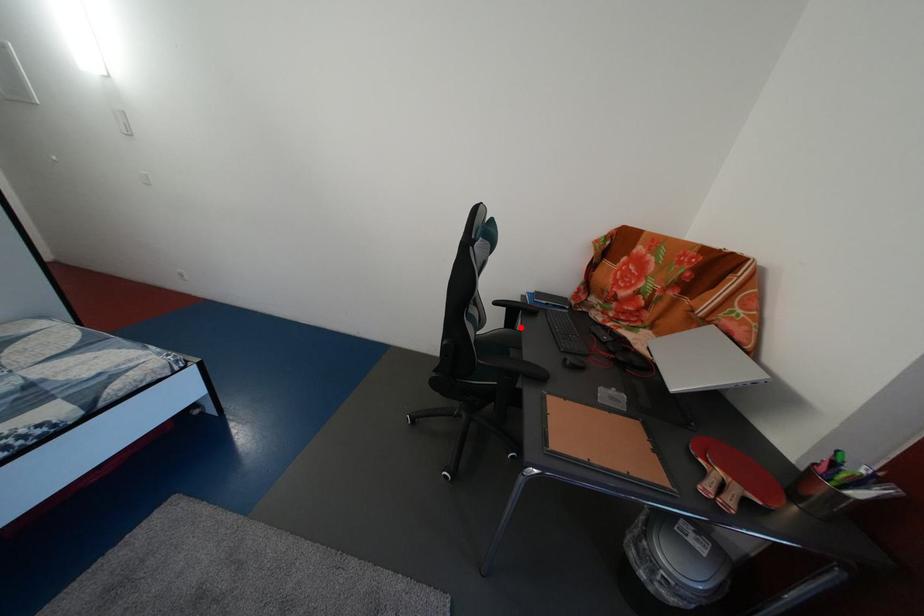
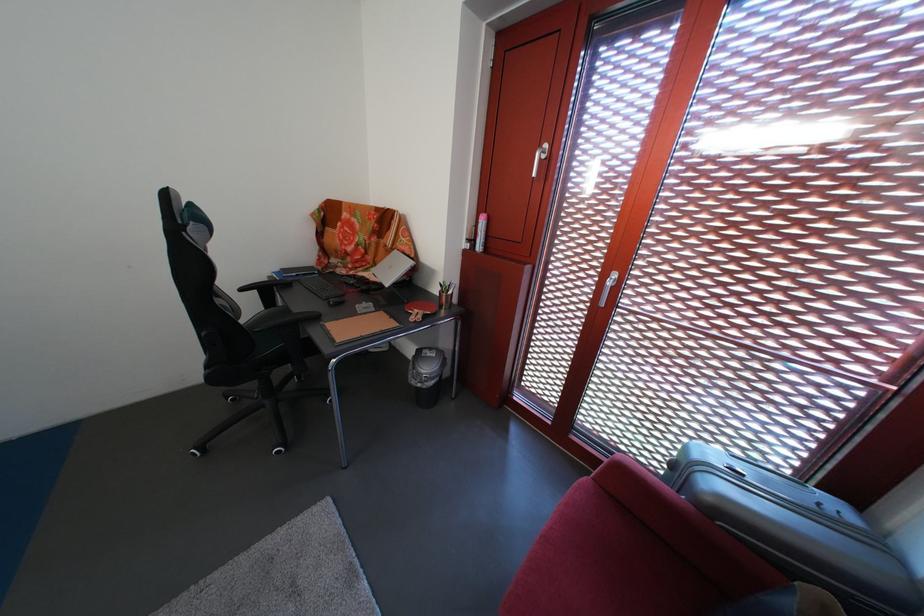
In the second image, find the point that corresponds to the highlighted location in the first image.

(280, 308)